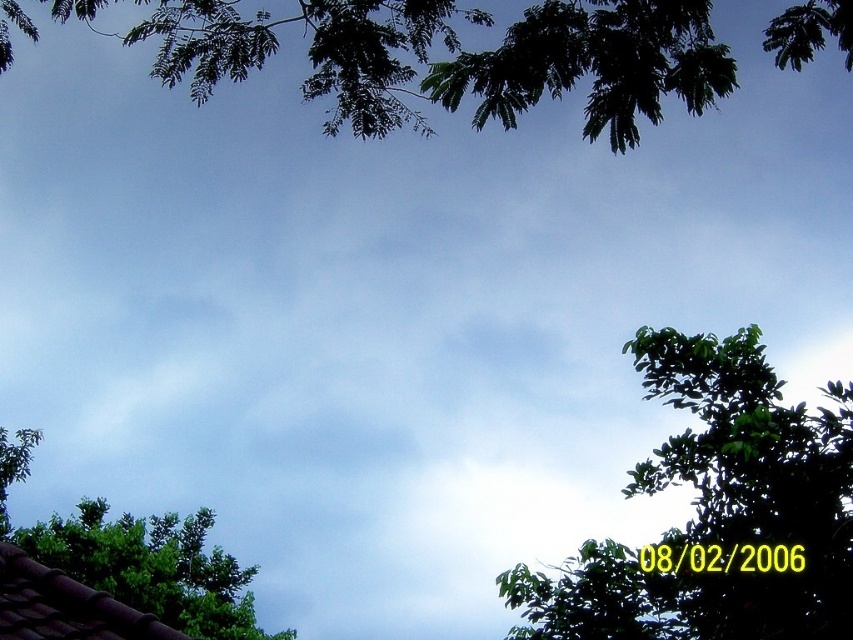
In the scene shown: Can you confirm if green leafy tree at right is positioned to the left of green leafy tree at lower left?

No, green leafy tree at right is not to the left of green leafy tree at lower left.

Locate an element on the screen. This screenshot has height=640, width=853. green leafy tree at right is located at coordinates (717, 513).

Who is more forward, (688, 93) or (219, 588)?

Point (688, 93) is more forward.

Consider the image. Does green leafy branches at upper center appear on the left side of green leafy tree at lower left?

Incorrect, green leafy branches at upper center is not on the left side of green leafy tree at lower left.

What do you see at coordinates (451, 58) in the screenshot? This screenshot has height=640, width=853. I see `green leafy branches at upper center` at bounding box center [451, 58].

Where is `green leafy branches at upper center`? green leafy branches at upper center is located at coordinates (451, 58).

Identify the location of green leafy tree at right. This screenshot has height=640, width=853. (717, 513).